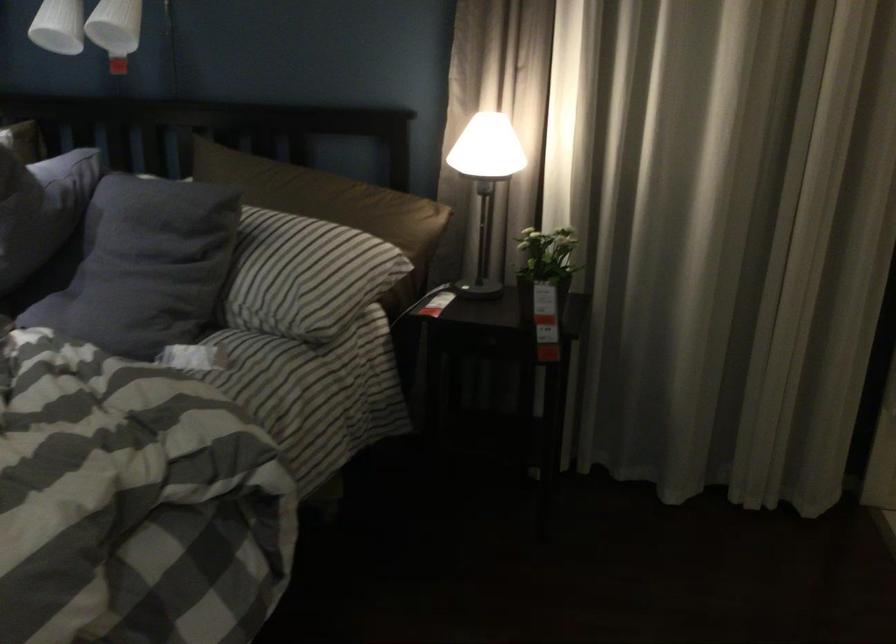
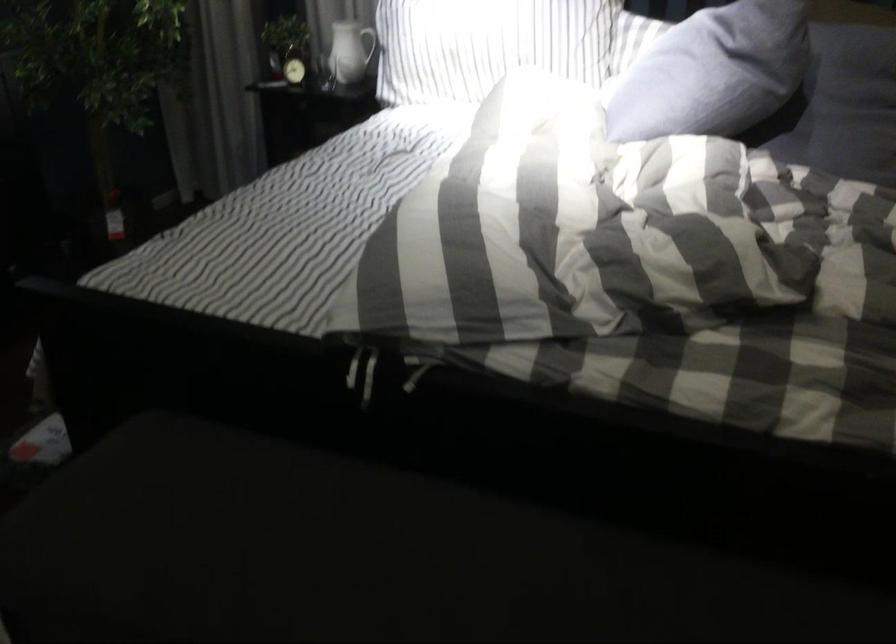
Question: The images are taken continuously from a first-person perspective. In which direction are you moving?

Choices:
 (A) Left
 (B) Right
 (C) Forward
 (D) Backward

Answer: (A)